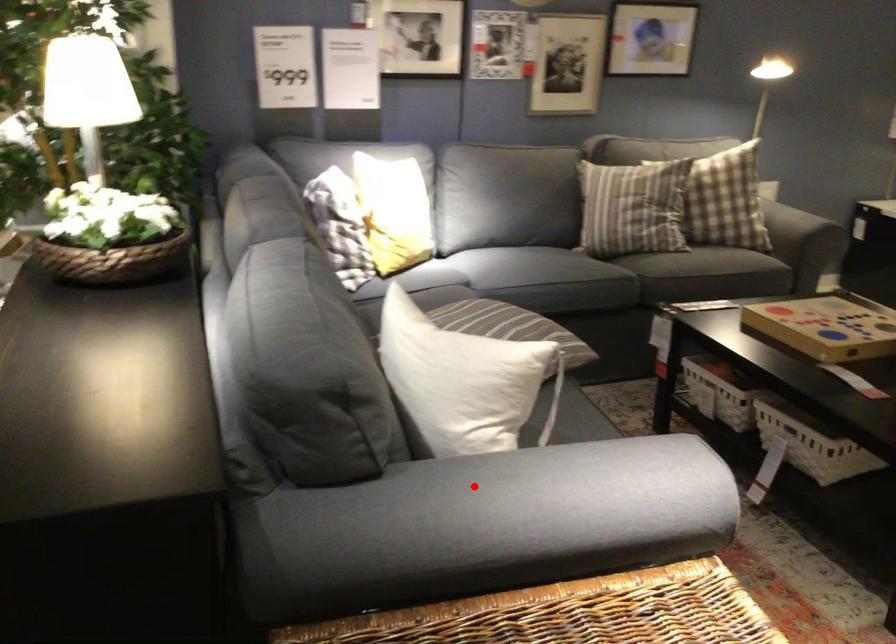
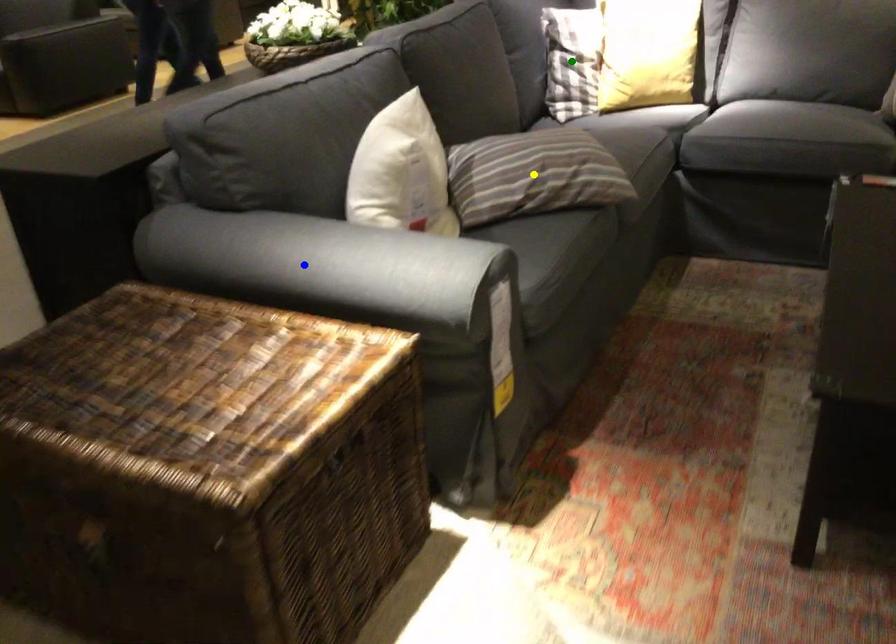
Question: I am providing you with two images of the same scene from different viewpoints. A red point is marked on the first image. You are given multiple points on the second image. Which point in image 2 is actually the same real-world point as the red point in image 1?

Choices:
 (A) blue point
 (B) green point
 (C) yellow point

Answer: (A)